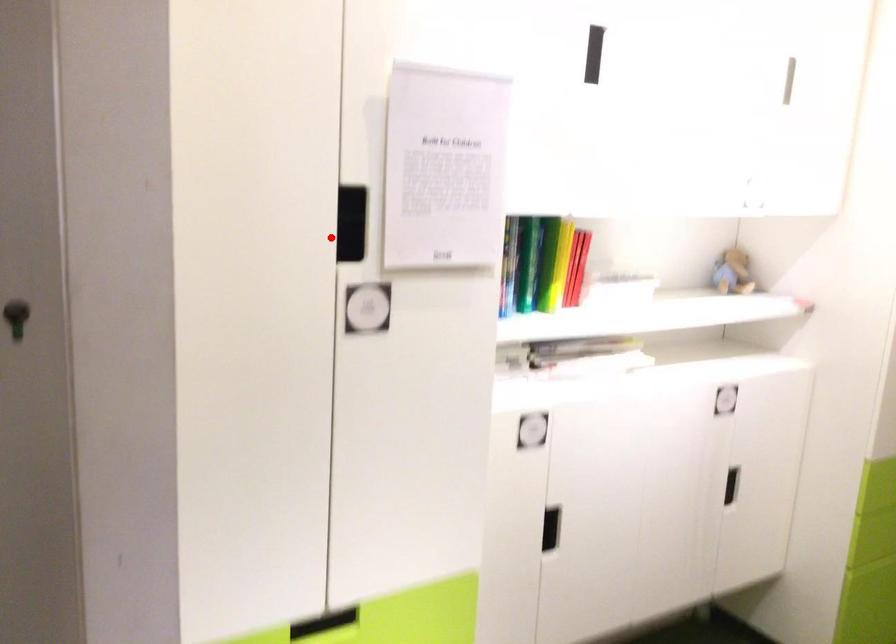
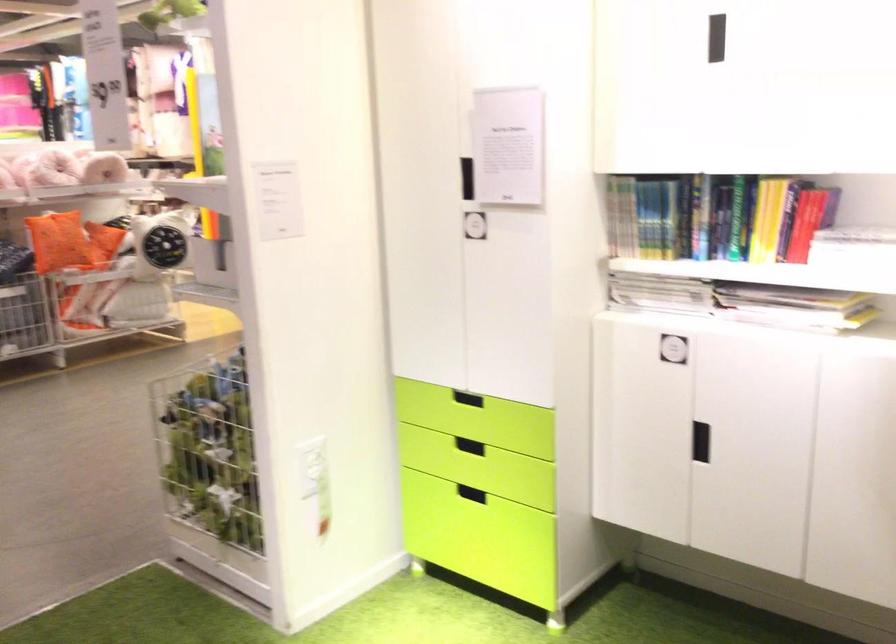
In the second image, find the point that corresponds to the highlighted location in the first image.

(467, 178)